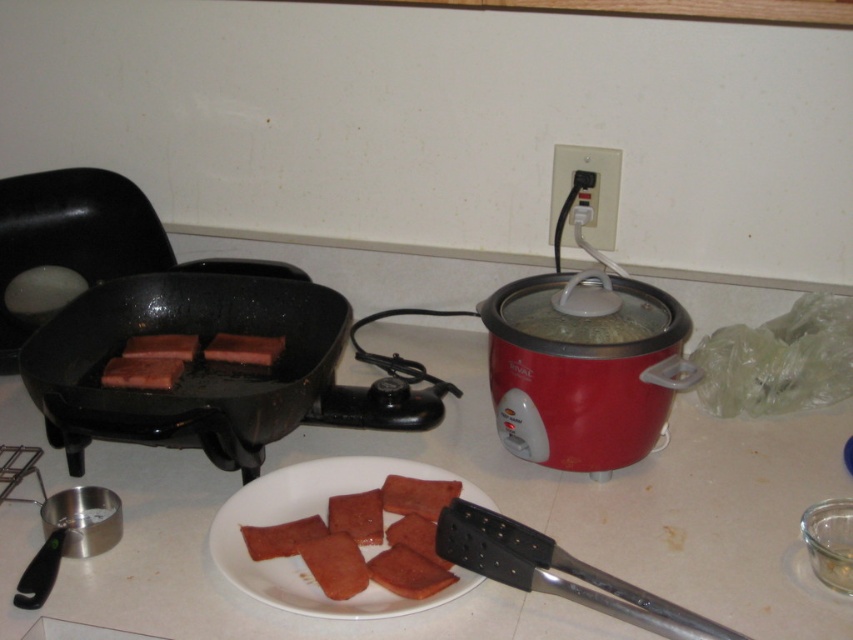
You are preparing a meal and need to place a plate between the red matte rice cooker at right and the pinkish matte ham at center. Which object should you move to make space?

The red matte rice cooker at right is taller than the pinkish matte ham at center, so you should move the red matte rice cooker at right to make space for the plate.